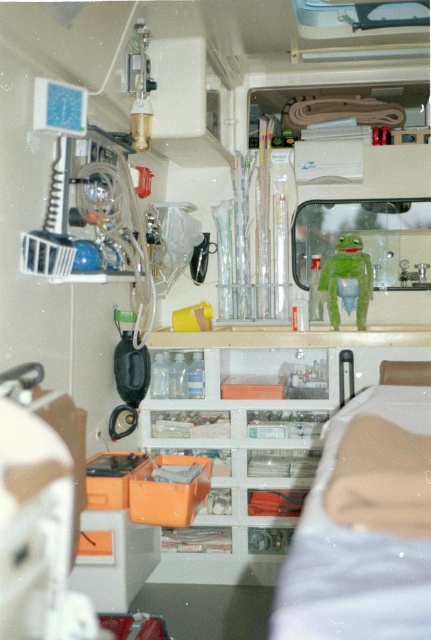
You are standing in the medical vehicle and need to reach the point at coordinates (333,467). If your arm can extend 1.2 meters, can you reach that point without moving?

The point at coordinates (333,467) is 1.28 meters away from you, which is slightly beyond your arm reach of 1.2 meters. Therefore, you cannot reach it without moving closer.

Based on the photo, you are a paramedic preparing to place a green matte Kermit the Frog at center on the beige fabric bed at center. Can you fit the frog on the bed without it hanging off the edges?

The beige fabric bed at center might be wider than green matte kermit the frog at center, so there is a possibility that the frog can fit on the bed without overhanging. However, the exact dimensions are uncertain based on the provided information.